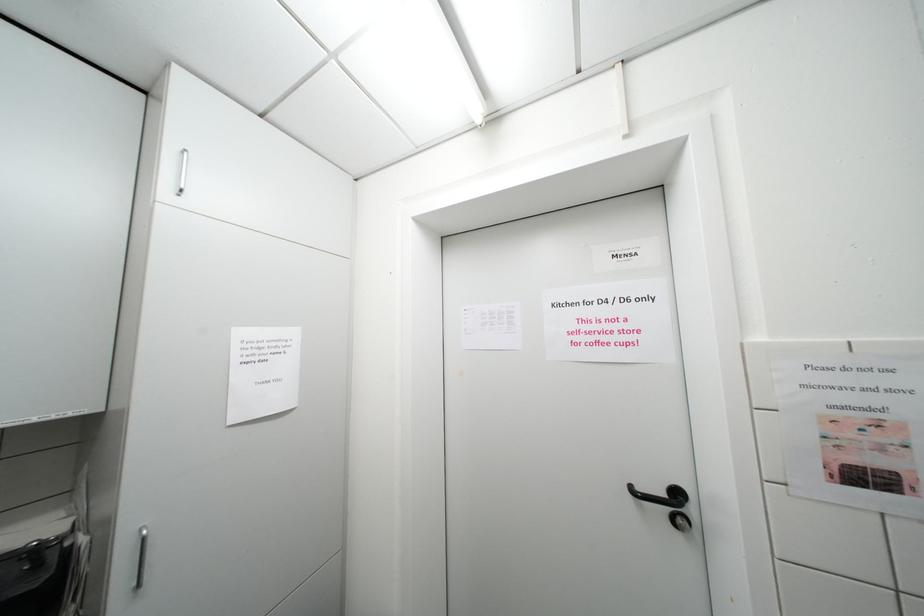
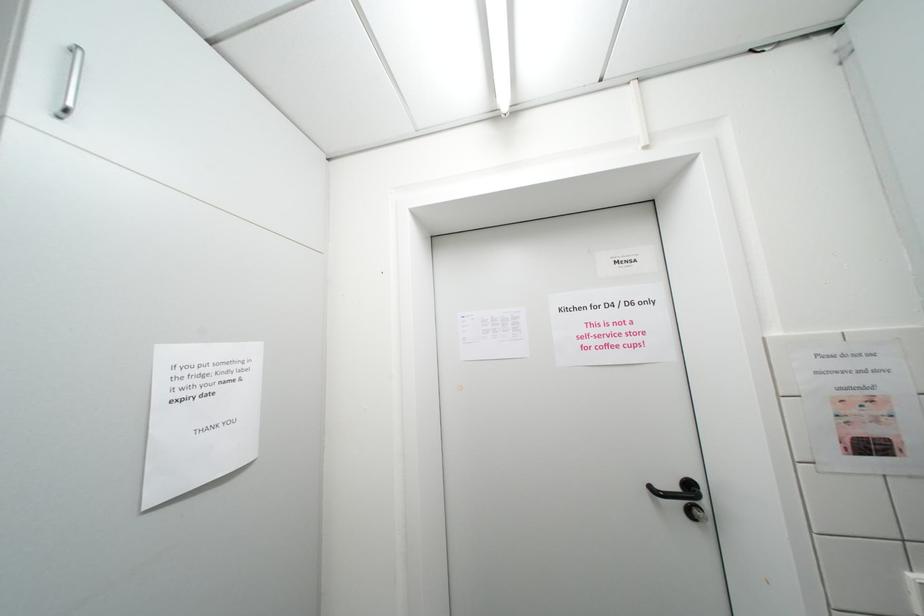
In a continuous first-person perspective shot, in which direction is the camera moving?

The movement direction of the cameraman is left, forward.